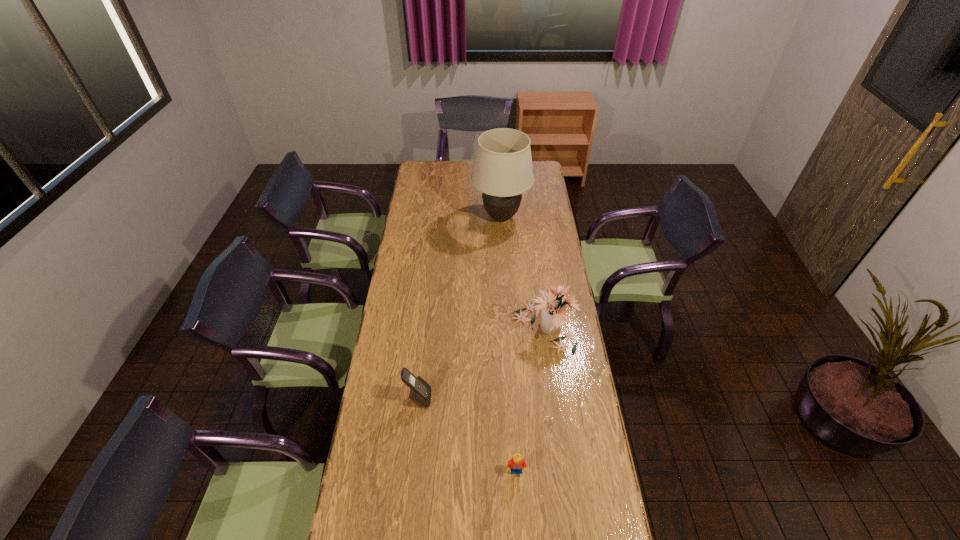
Where is `vacant area located on the front-facing side of the cellular telephone`? The width and height of the screenshot is (960, 540). vacant area located on the front-facing side of the cellular telephone is located at coordinates point(515,398).

Find the location of a particular element. vacant point located 0.150m on the face of the shortest object is located at coordinates (519, 527).

The width and height of the screenshot is (960, 540). What are the coordinates of `object at the left edge` in the screenshot? It's located at (420, 391).

Where is `lampshade situated at the right edge`? Image resolution: width=960 pixels, height=540 pixels. lampshade situated at the right edge is located at coordinates (503, 170).

What are the coordinates of `bouquet present at the right edge` in the screenshot? It's located at (553, 314).

The width and height of the screenshot is (960, 540). I want to click on blank area at the left edge, so click(396, 315).

You are a GUI agent. You are given a task and a screenshot of the screen. Output one action in this format:
    pyautogui.click(x=<x>, y=<y>)
    Task: Click on the free point at the right edge
    
    Given the screenshot: What is the action you would take?
    pyautogui.click(x=562, y=327)

Locate an element on the screen. blank area at the far right corner is located at coordinates (538, 169).

Locate an element on the screen. empty space that is in between the leftmost object and the bouquet is located at coordinates (481, 363).

What are the coordinates of `free space between the shortest object and the second shortest object` in the screenshot? It's located at (468, 435).